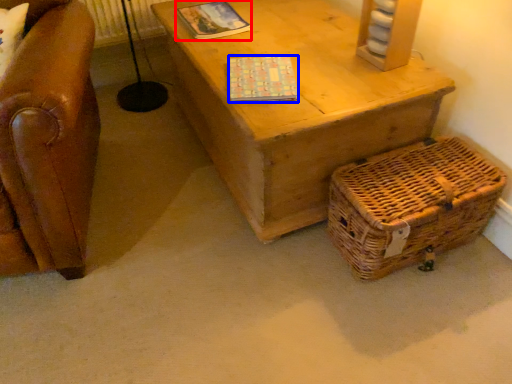
Question: Among these objects, which one is nearest to the camera, magazine (highlighted by a red box) or magazine (highlighted by a blue box)?

Choices:
 (A) magazine
 (B) magazine

Answer: (B)